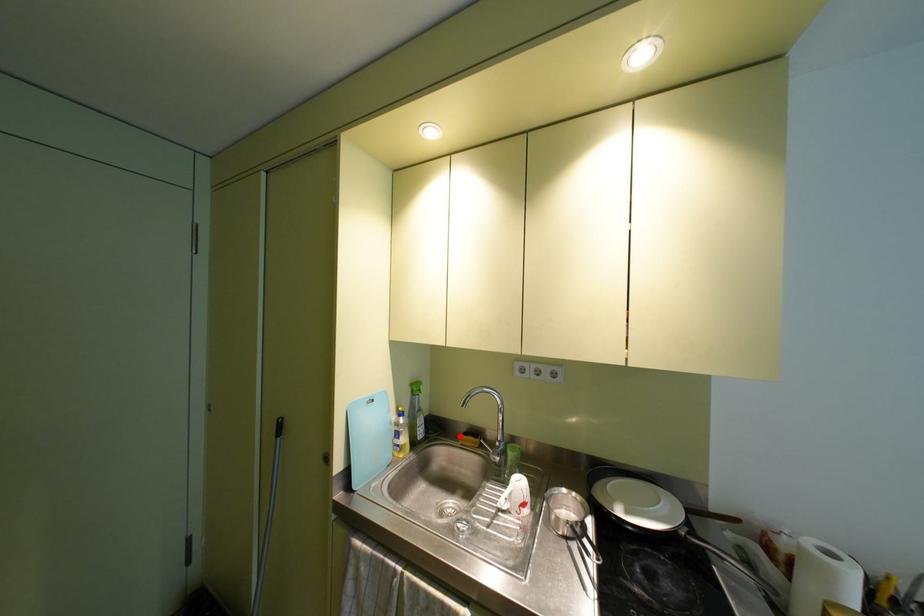
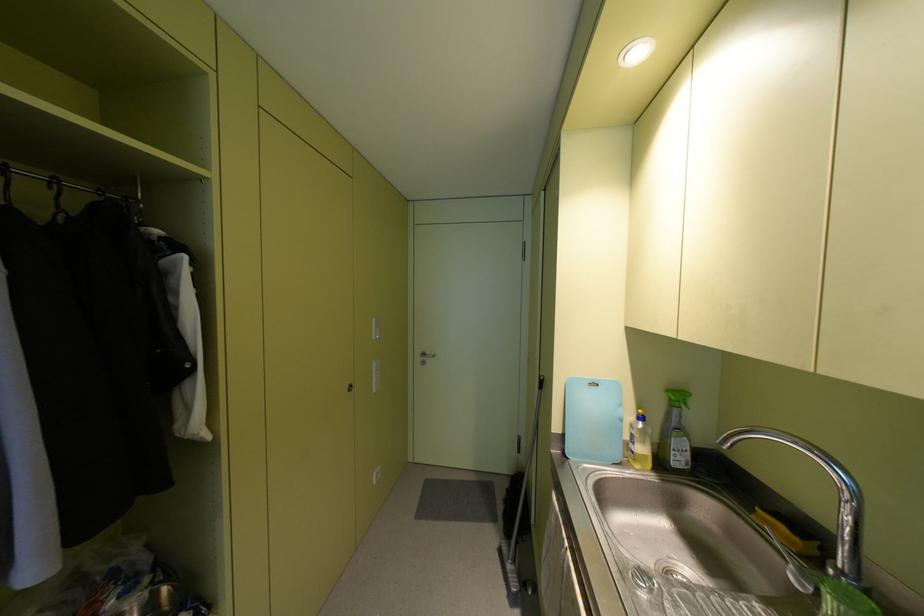
Question: I am providing you with two images of the same scene from different viewpoints. A red point is shown in image1. For the corresponding object point in image2, is it positioned nearer or farther from the camera?

Choices:
 (A) Nearer
 (B) Farther

Answer: (A)